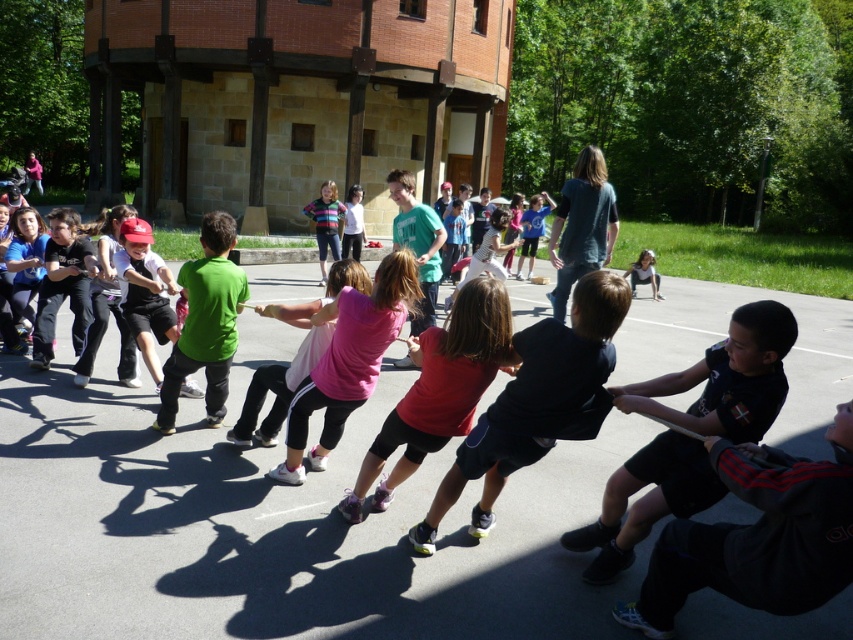
Question: Does green jersey at center lie behind matte black shirt at center?

Choices:
 (A) yes
 (B) no

Answer: (B)

Question: Among these points, which one is farthest from the camera?

Choices:
 (A) (808, 314)
 (B) (645, 253)

Answer: (B)

Question: Where is green jersey at center located in relation to matte black shirt at center in the image?

Choices:
 (A) left
 (B) right

Answer: (A)

Question: Which of the following is the farthest from the observer?

Choices:
 (A) (207, 552)
 (B) (648, 276)

Answer: (B)

Question: Is green jersey at center closer to camera compared to matte black shirt at center?

Choices:
 (A) no
 (B) yes

Answer: (B)

Question: Which point is closer to the camera?

Choices:
 (A) (143, 346)
 (B) (645, 260)

Answer: (A)